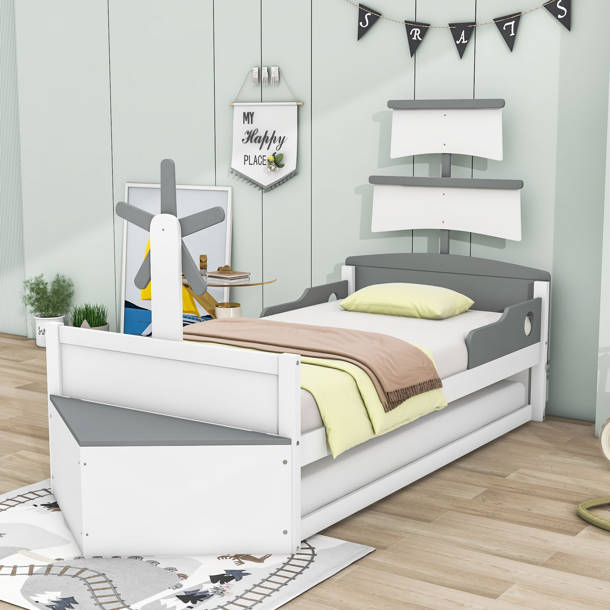
Find the location of a particular element. This screenshot has height=610, width=610. houseplants is located at coordinates (40, 305), (92, 320).